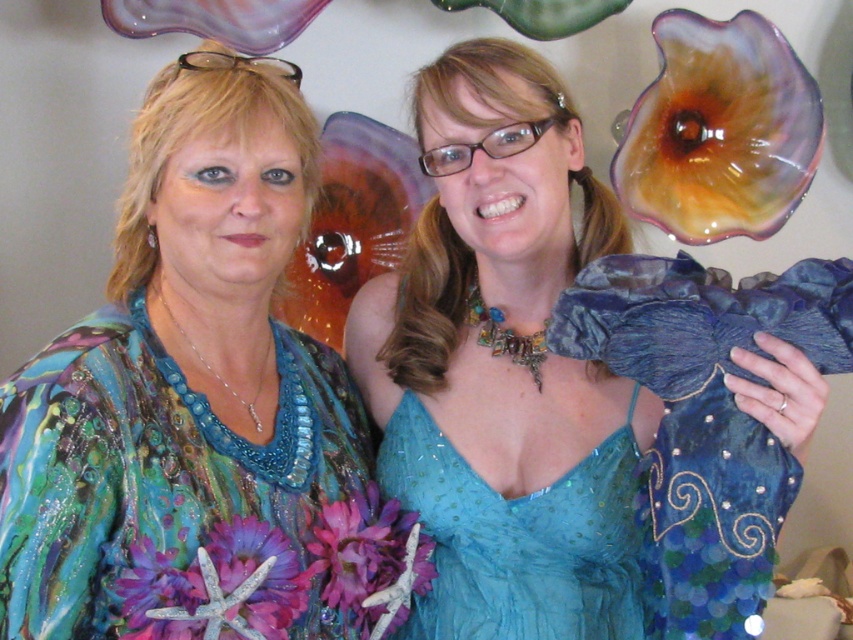
Who is positioned more to the right, shiny blue dress at center or teal sheer dress at center?

From the viewer's perspective, teal sheer dress at center appears more on the right side.

Can you confirm if shiny blue dress at center is positioned below teal sheer dress at center?

Incorrect, shiny blue dress at center is not positioned below teal sheer dress at center.

Identify the location of shiny blue dress at center. The height and width of the screenshot is (640, 853). (198, 406).

Who is taller, blue sequined dress at center or teal sheer dress at center?

blue sequined dress at center is taller.

Can you confirm if blue sequined dress at center is smaller than teal sheer dress at center?

No, blue sequined dress at center is not smaller than teal sheer dress at center.

You are a GUI agent. You are given a task and a screenshot of the screen. Output one action in this format:
    pyautogui.click(x=<x>, y=<y>)
    Task: Click on the blue sequined dress at center
    
    Given the screenshot: What is the action you would take?
    pyautogui.click(x=503, y=368)

Locate an element on the screen. blue sequined dress at center is located at coordinates pos(503,368).

Does point (231, 188) lie behind point (608, 528)?

No, (231, 188) is in front of (608, 528).

What do you see at coordinates (198, 406) in the screenshot? The width and height of the screenshot is (853, 640). I see `shiny blue dress at center` at bounding box center [198, 406].

Who is more forward, (155,276) or (509,344)?

Point (155,276)

The height and width of the screenshot is (640, 853). Find the location of `shiny blue dress at center`. shiny blue dress at center is located at coordinates (198, 406).